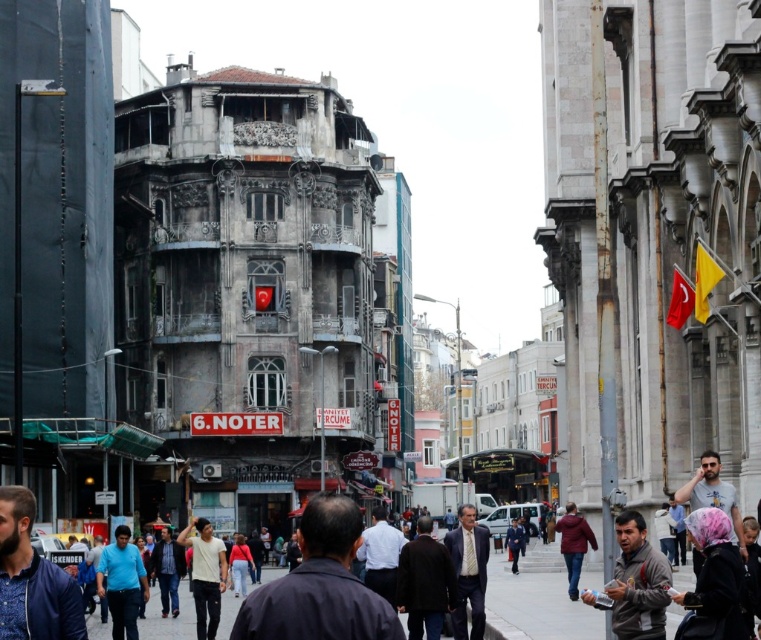
Between blue shirt at lower left and dark suit at center, which one is positioned lower?

Positioned lower is dark suit at center.

Is point (2, 490) farther from camera compared to point (479, 538)?

That is False.

Between point (11, 554) and point (470, 557), which one is positioned behind?

Point (470, 557)

This screenshot has height=640, width=761. What are the coordinates of `blue shirt at lower left` in the screenshot? It's located at (32, 579).

Which is more to the right, dark suit at center or blue shirt at center?

From the viewer's perspective, dark suit at center appears more on the right side.

The image size is (761, 640). I want to click on dark suit at center, so click(x=467, y=572).

Which of these two, dark blue shirt at center or blue shirt at lower left, stands shorter?

blue shirt at lower left

Does point (260, 632) come closer to viewer compared to point (59, 636)?

Yes, point (260, 632) is in front of point (59, 636).

This screenshot has height=640, width=761. What are the coordinates of `dark blue shirt at center` in the screenshot? It's located at (319, 586).